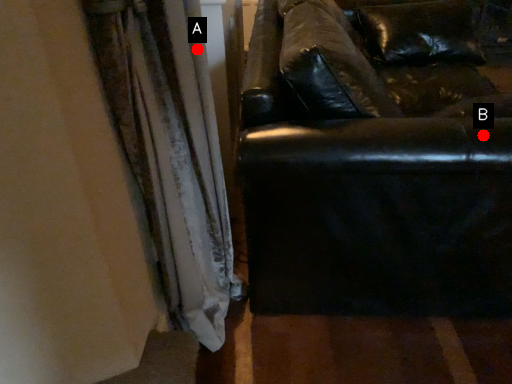
Question: Two points are circled on the image, labeled by A and B beside each circle. Which point is closer to the camera taking this photo?

Choices:
 (A) A is closer
 (B) B is closer

Answer: (A)